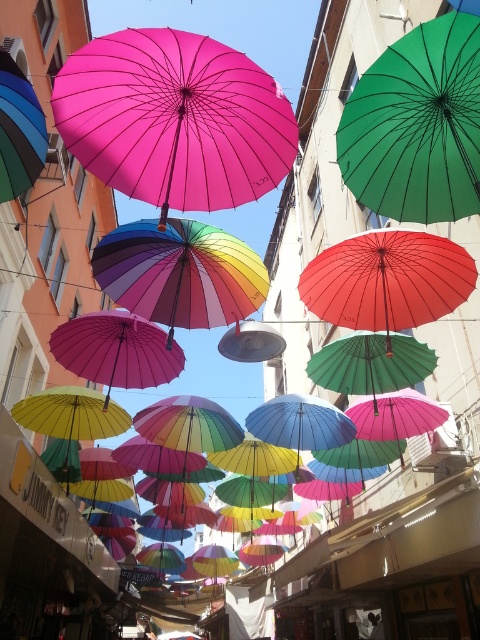
Question: From the image, what is the correct spatial relationship of green matte umbrella at upper right in relation to rainbow fabric umbrella at center?

Choices:
 (A) left
 (B) right

Answer: (B)

Question: Is rainbow fabric umbrella at center to the right of red matte umbrella at center from the viewer's perspective?

Choices:
 (A) no
 (B) yes

Answer: (A)

Question: Among these points, which one is nearest to the camera?

Choices:
 (A) (350, 308)
 (B) (202, 301)
 (C) (448, 68)

Answer: (C)

Question: Is green matte umbrella at upper right closer to the viewer compared to red matte umbrella at center?

Choices:
 (A) yes
 (B) no

Answer: (A)

Question: Which point is farther to the camera?

Choices:
 (A) pink matte umbrella at upper center
 (B) rainbow fabric umbrella at center
 (C) red matte umbrella at center
 (D) green matte umbrella at upper right

Answer: (C)

Question: Which point is farther to the camera?

Choices:
 (A) (392, 216)
 (B) (212, 104)
 (C) (149, 308)
 (D) (369, 257)

Answer: (D)